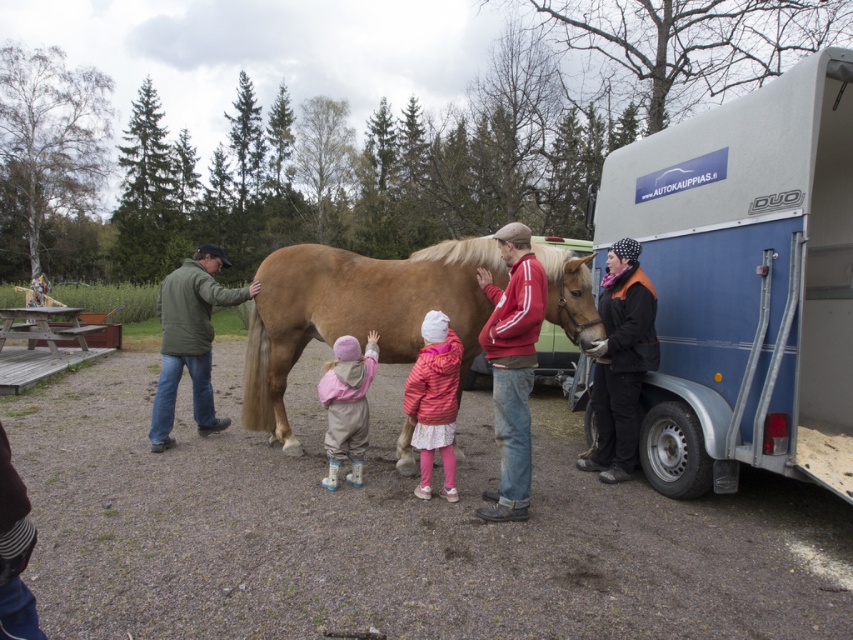
You are standing at point A at coordinates point [204,298] and want to move to point B at coordinates point [337,381]. Based on the scene description, which direction should you move to reach point B from point A?

Point [204,298] is behind point [337,381], so you should move forward to reach point B from point A.